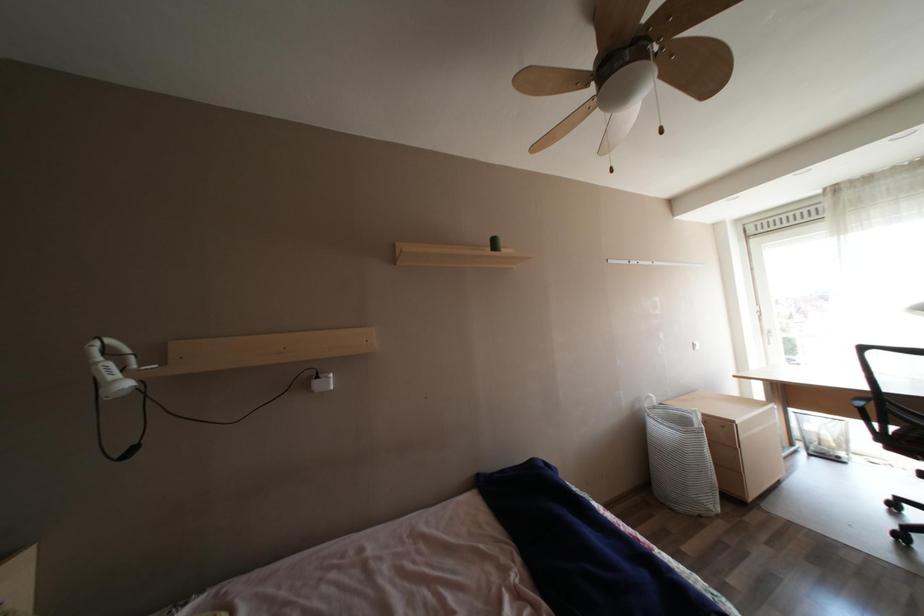
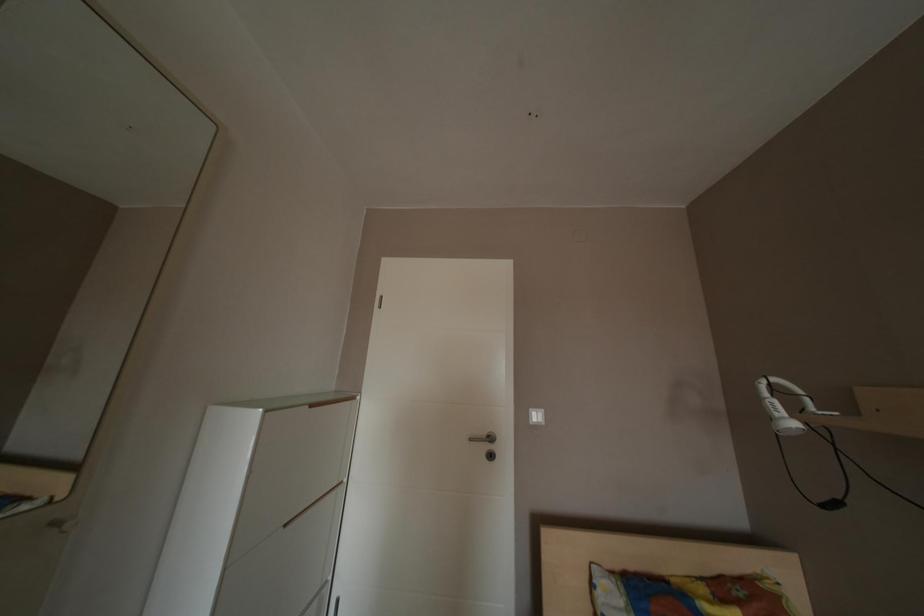
Question: The camera is either moving clockwise (left) or counter-clockwise (right) around the object. The first image is from the beginning of the video and the second image is from the end. Is the camera moving left or right when shooting the video?

Choices:
 (A) Left
 (B) Right

Answer: (B)